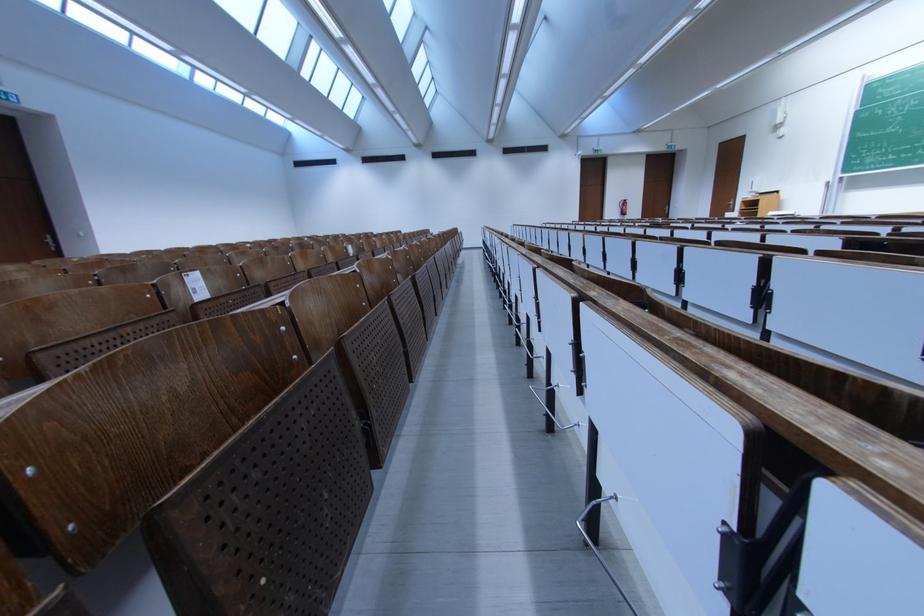
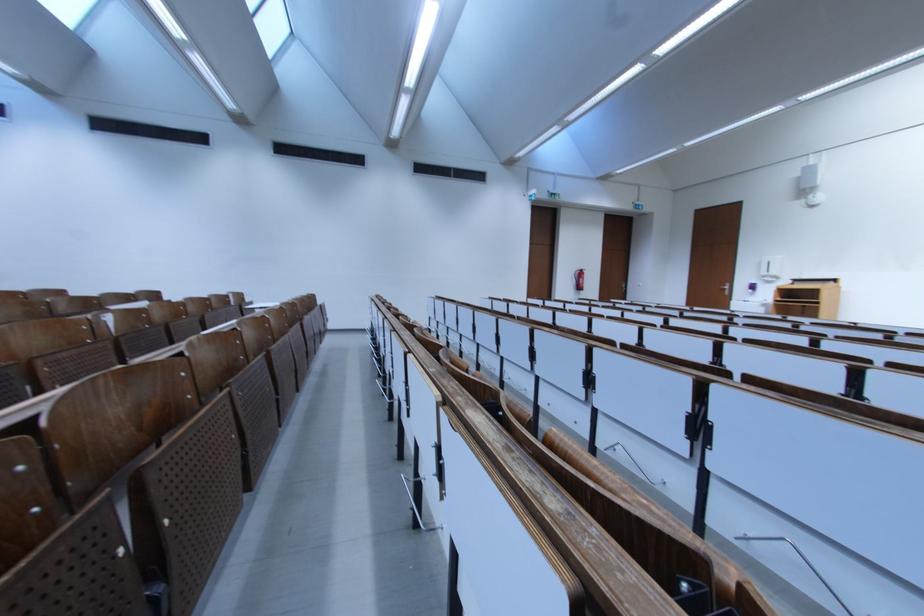
Where in the second image is the point corresponding to [628,211] from the first image?

(584, 284)